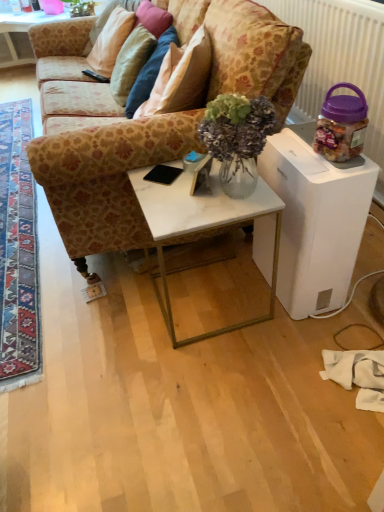
Image resolution: width=384 pixels, height=512 pixels. In order to click on vacant area that is in front of white glossy humidifier at right, which is the second table from bottom to top in this screenshot , I will do `click(301, 339)`.